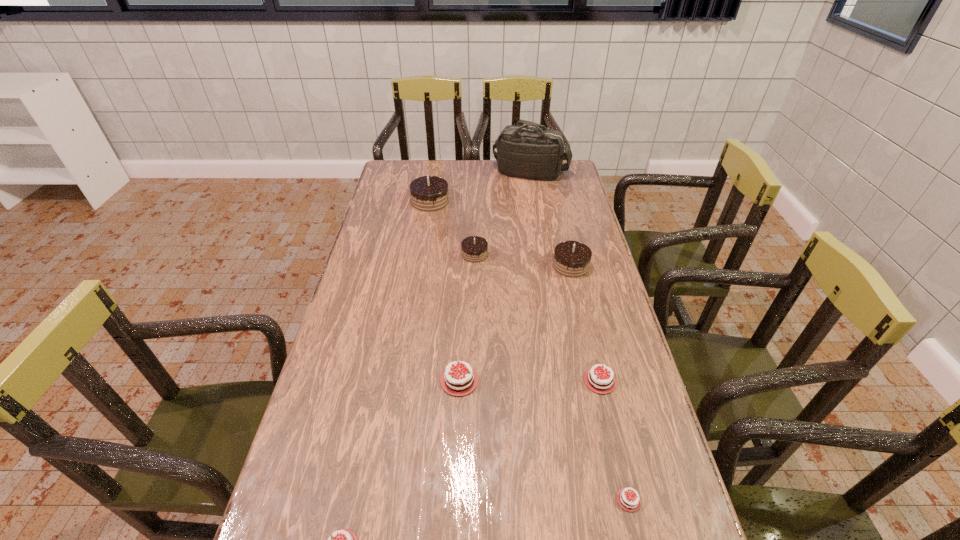
This screenshot has width=960, height=540. Identify the location of the fifth tallest chocolate cake. pos(602,382).

Image resolution: width=960 pixels, height=540 pixels. I want to click on the third smallest red chocolate cake, so (602, 382).

Find the location of a particular element. the shortest object is located at coordinates (628, 500).

You are a GUI agent. You are given a task and a screenshot of the screen. Output one action in this format:
    pyautogui.click(x=<x>, y=<y>)
    Task: Click on the shortest chocolate cake
    The width and height of the screenshot is (960, 540).
    Given the screenshot: What is the action you would take?
    point(628,500)

Where is `vacant space positioned at the front padded panel of the tallest object`? The image size is (960, 540). vacant space positioned at the front padded panel of the tallest object is located at coordinates (539, 219).

The image size is (960, 540). Find the location of `free space located 0.120m on the left of the seventh shortest object`. free space located 0.120m on the left of the seventh shortest object is located at coordinates (381, 201).

Identify the location of vacant space located on the back of the sixth shortest chocolate cake. Image resolution: width=960 pixels, height=540 pixels. (557, 205).

The height and width of the screenshot is (540, 960). What are the coordinates of `vacant space located 0.230m on the front of the fifth shortest object` in the screenshot? It's located at (474, 312).

Find the location of a particular element. Image resolution: width=960 pixels, height=540 pixels. vacant area located on the back of the biggest red chocolate cake is located at coordinates (464, 267).

Image resolution: width=960 pixels, height=540 pixels. In order to click on vacant space situated on the left of the third smallest red chocolate cake in this screenshot , I will do `click(417, 381)`.